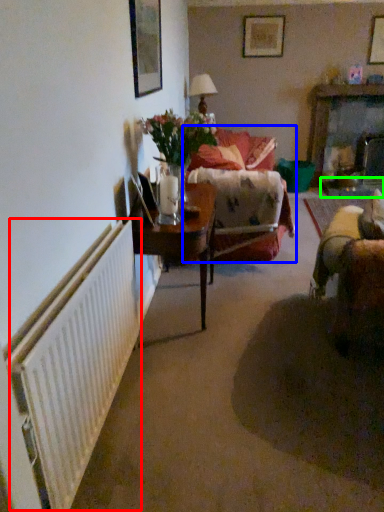
Question: Based on their relative distances, which object is farther from radiator (highlighted by a red box)? Choose from studio couch (highlighted by a blue box) and glass table (highlighted by a green box).

Choices:
 (A) studio couch
 (B) glass table

Answer: (B)